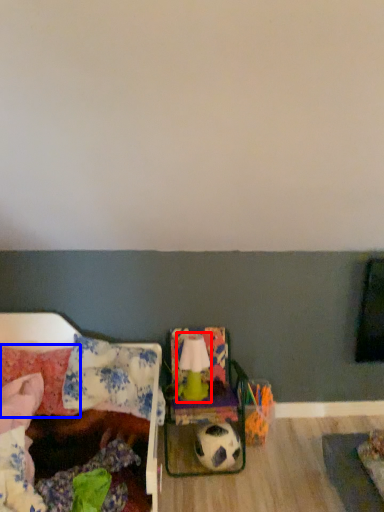
Question: Which object is further to the camera taking this photo, lamp (highlighted by a red box) or pillow (highlighted by a blue box)?

Choices:
 (A) lamp
 (B) pillow

Answer: (A)